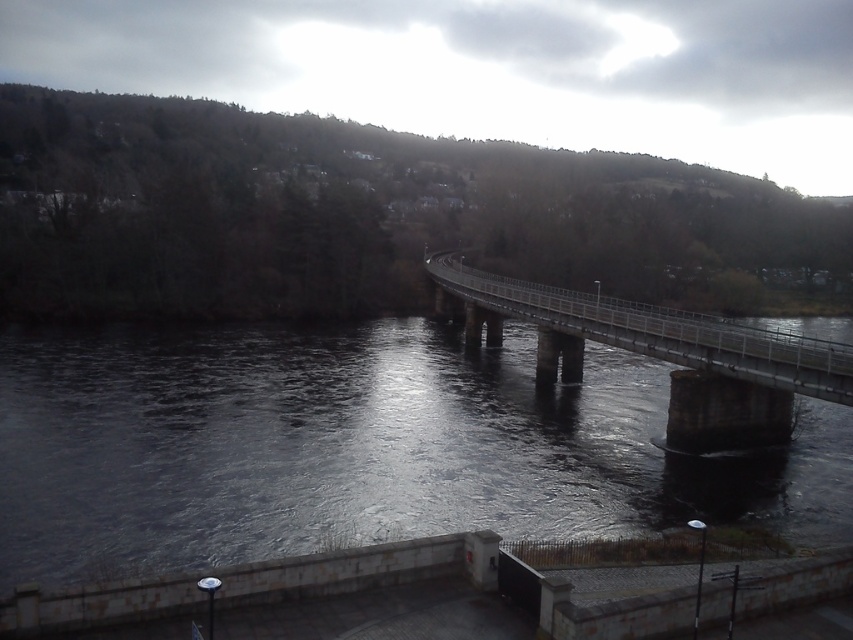
Can you confirm if dark gray concrete river at center is positioned below metallic gray bridge at center?

Yes, dark gray concrete river at center is below metallic gray bridge at center.

Who is shorter, dark gray concrete river at center or metallic gray bridge at center?

With less height is dark gray concrete river at center.

This screenshot has height=640, width=853. In order to click on dark gray concrete river at center in this screenshot , I will do `click(354, 448)`.